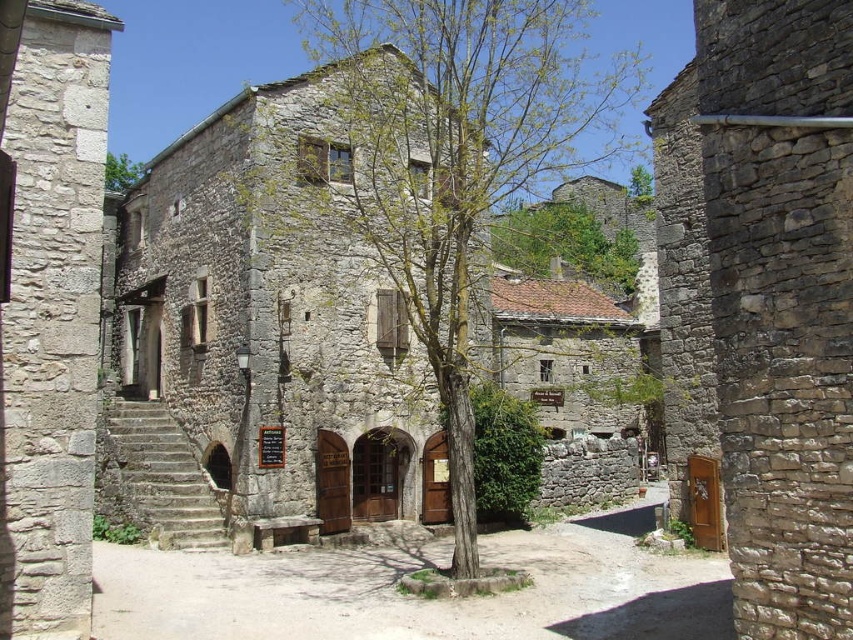
You are standing in the village square and want to walk towards the central stone building. There are two points marked on the ground in front of you. One is at point (314,204) and the other is at point (128,184). Which point will you reach first as you walk towards the building?

Point (314,204) will be reached first because it is closer to the viewer compared to point (128,184).

You are standing in the village square and notice the dull stone alley at center and the green leafy tree at upper center. Which of these two objects takes up more space in the scene?

The green leafy tree at upper center occupies more space than the dull stone alley at center according to the description.